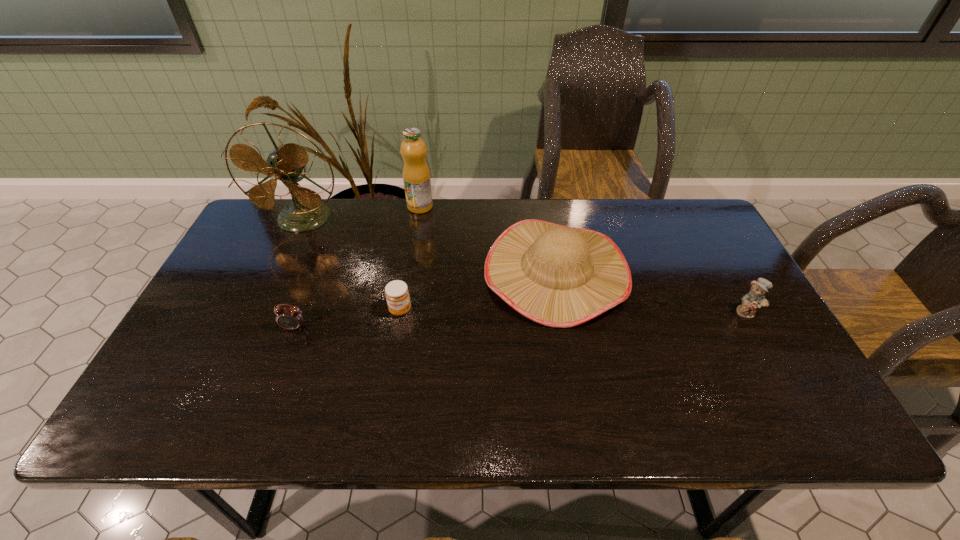
Identify the location of free space between the fifth object from left to right and the jam. The height and width of the screenshot is (540, 960). (478, 291).

Locate an element on the screen. free point between the sunhat and the fifth shortest object is located at coordinates (489, 239).

Where is `blank region between the jam and the second object from right to left`? The image size is (960, 540). blank region between the jam and the second object from right to left is located at coordinates (478, 291).

Identify the location of free space between the fan and the sunhat. click(x=430, y=245).

You are a GUI agent. You are given a task and a screenshot of the screen. Output one action in this format:
    pyautogui.click(x=<x>, y=<y>)
    Task: Click on the second closest object to the fifth shortest object
    The image size is (960, 540).
    Given the screenshot: What is the action you would take?
    pyautogui.click(x=559, y=276)

Identify which object is the closest to the teddy bear. Please provide its 2D coordinates. Your answer should be formatted as a tuple, i.e. [(x, y)], where the tuple contains the x and y coordinates of a point satisfying the conditions above.

[(559, 276)]

Find the location of `vacant space that satisfies the following two spatial constraints: 1. in front of the fan, directing air flow; 2. on the left side of the fourth shortest object`. vacant space that satisfies the following two spatial constraints: 1. in front of the fan, directing air flow; 2. on the left side of the fourth shortest object is located at coordinates (278, 272).